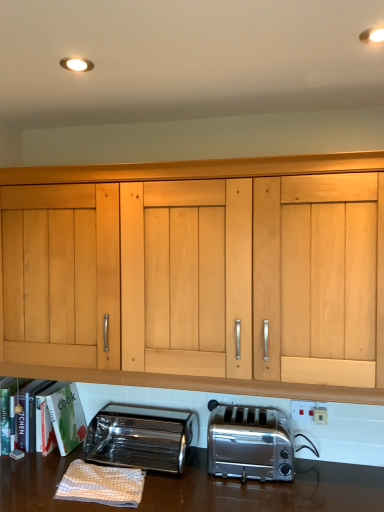
Question: From a real-world perspective, is polished stainless steel toaster at lower left, arranged as the first toaster when viewed from the left, positioned over satin silver toaster at lower center, positioned as the first toaster in right-to-left order, based on gravity?

Choices:
 (A) no
 (B) yes

Answer: (A)

Question: Considering the relative sizes of polished stainless steel toaster at lower left, arranged as the first toaster when viewed from the left, and satin silver toaster at lower center, the 2th toaster from the left, in the image provided, is polished stainless steel toaster at lower left, arranged as the first toaster when viewed from the left, wider than satin silver toaster at lower center, the 2th toaster from the left,?

Choices:
 (A) no
 (B) yes

Answer: (B)

Question: Are polished stainless steel toaster at lower left, which is the 2th toaster from right to left, and satin silver toaster at lower center, positioned as the first toaster in right-to-left order, beside each other?

Choices:
 (A) no
 (B) yes

Answer: (A)

Question: Is polished stainless steel toaster at lower left, arranged as the first toaster when viewed from the left, positioned in front of satin silver toaster at lower center, the 2th toaster from the left?

Choices:
 (A) no
 (B) yes

Answer: (A)

Question: From the image's perspective, is polished stainless steel toaster at lower left, arranged as the first toaster when viewed from the left, under satin silver toaster at lower center, the 2th toaster from the left?

Choices:
 (A) no
 (B) yes

Answer: (B)

Question: In the image, is white plastic electrical outlet at lower center, which appears as the 1th electric outlet when viewed from the right, positioned in front of or behind satin silver toaster at lower center, positioned as the first toaster in right-to-left order?

Choices:
 (A) front
 (B) behind

Answer: (B)

Question: Is white plastic electrical outlet at lower center, which is the second electric outlet in left-to-right order, inside the boundaries of satin silver toaster at lower center, the 2th toaster from the left, or outside?

Choices:
 (A) inside
 (B) outside

Answer: (A)

Question: In terms of width, does white plastic electrical outlet at lower center, which appears as the 1th electric outlet when viewed from the right, look wider or thinner when compared to satin silver toaster at lower center, positioned as the first toaster in right-to-left order?

Choices:
 (A) thin
 (B) wide

Answer: (A)

Question: Is point (297, 402) closer or farther from the camera than point (228, 407)?

Choices:
 (A) closer
 (B) farther

Answer: (A)

Question: In terms of width, does white plastic electric outlet at center, the 2th electric outlet viewed from the right, look wider or thinner when compared to white plastic electrical outlet at lower center, which appears as the 1th electric outlet when viewed from the right?

Choices:
 (A) thin
 (B) wide

Answer: (A)

Question: Is white plastic electric outlet at center, the 2th electric outlet viewed from the right, to the left or to the right of white plastic electrical outlet at lower center, the first electric outlet viewed from the front, in the image?

Choices:
 (A) left
 (B) right

Answer: (A)

Question: Is white plastic electric outlet at center, arranged as the first electric outlet when viewed from the back, bigger or smaller than white plastic electrical outlet at lower center, which appears as the 1th electric outlet when viewed from the right?

Choices:
 (A) big
 (B) small

Answer: (B)

Question: Relative to white plastic electrical outlet at lower center, which appears as the 1th electric outlet when viewed from the right, is white plastic electric outlet at center, arranged as the first electric outlet when viewed from the back, in front or behind?

Choices:
 (A) front
 (B) behind

Answer: (B)

Question: Relative to white checkered cloth at lower left, is satin silver toaster at lower center, the 2th toaster from the left, in front or behind?

Choices:
 (A) behind
 (B) front

Answer: (A)

Question: From a real-world perspective, relative to white checkered cloth at lower left, is satin silver toaster at lower center, the 2th toaster from the left, vertically above or below?

Choices:
 (A) below
 (B) above

Answer: (B)